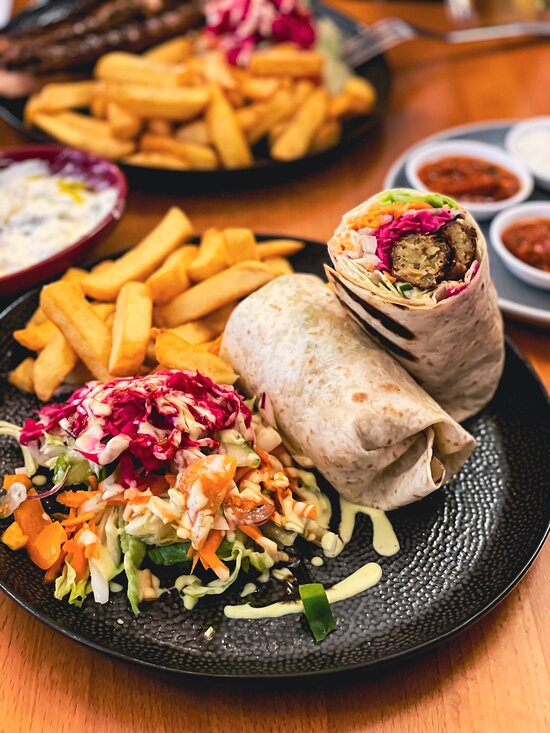
Where is `speckled plate`? This screenshot has height=733, width=550. speckled plate is located at coordinates (480, 556).